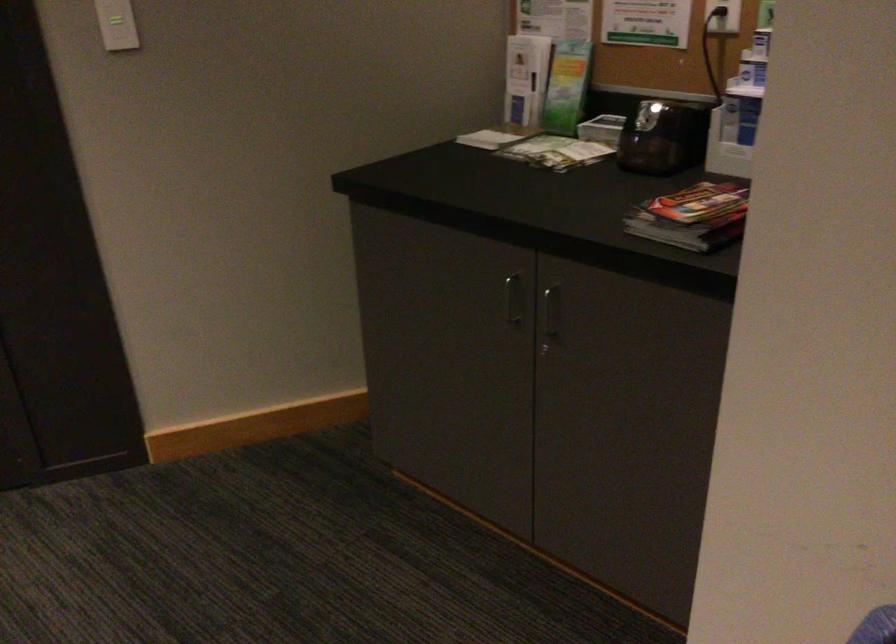
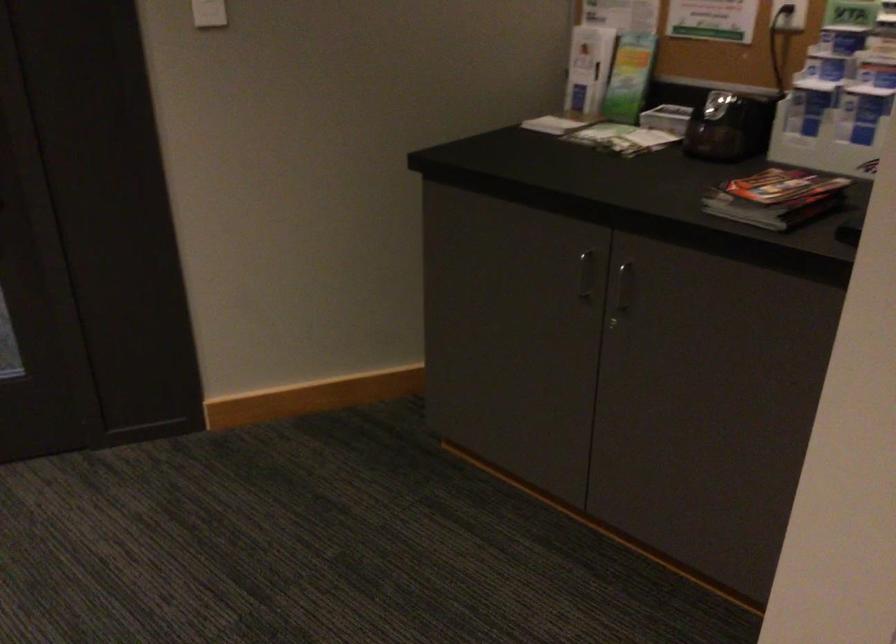
The point at (x=702, y=216) is marked in the first image. Where is the corresponding point in the second image?

(776, 198)